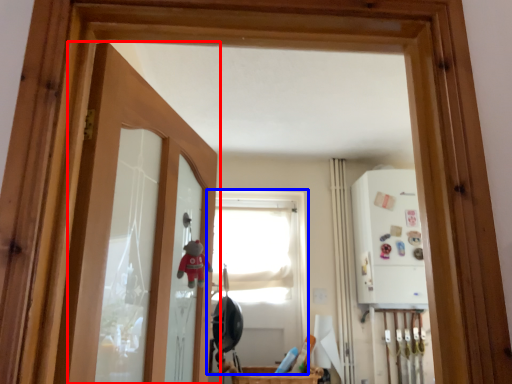
Question: Which object is closer to the camera taking this photo, door (highlighted by a red box) or window (highlighted by a blue box)?

Choices:
 (A) door
 (B) window

Answer: (A)